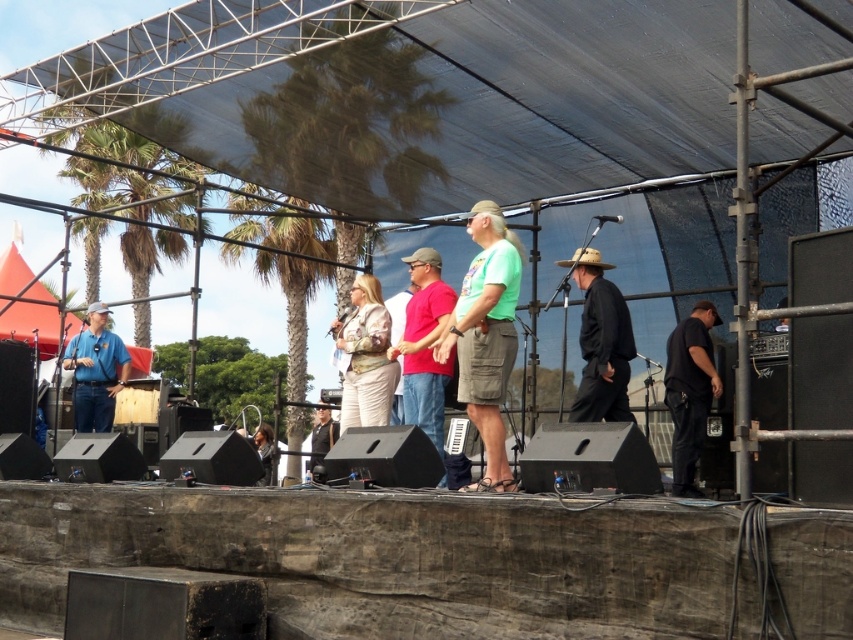
In the scene shown: You are standing at the back of the outdoor stage and want to move towards the front. There are two points marked on the stage floor, point (322, 412) and point (270, 460). Which point should you walk towards to reach the front edge of the stage first?

You should walk towards point (322, 412) because it is closer to the front edge of the stage than point (270, 460). Since point (322, 412) is further to the camera, it is positioned closer to the front of the stage, so reaching it first would get you nearer to the front edge.

You are standing at the point marked as point (585, 404) on the stage. You want to walk straight towards the front of the stage where the speakers are. How far will you have to walk?

The distance between point (585, 404) and the front of the stage is 10.49 meters.

You are a stagehand who needs to place a 1.2 meter wide equipment box between the black leather jacket at center and the dark brown leather jacket at lower center. Can the equipment box fit in the space between them?

The black leather jacket at center is narrower than the dark brown leather jacket at lower center, but the description only provides information about their widths, not the distance between them. Therefore, it is impossible to determine if the 1.2 meter wide equipment box can fit in the space between them based on the given information.